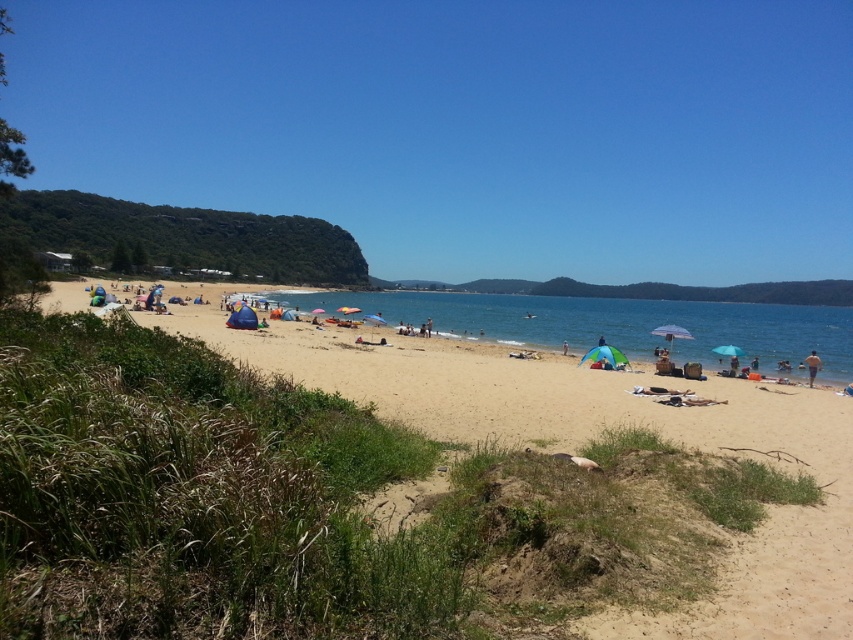
Question: Which of these objects is positioned closest to the clear blue water at center?

Choices:
 (A) tan skin person at lower right
 (B) transparent blue sky at upper center
 (C) beige sand beach at center

Answer: (C)

Question: Does beige sand beach at center come in front of clear blue water at center?

Choices:
 (A) no
 (B) yes

Answer: (B)

Question: Does beige sand beach at center have a lesser width compared to clear blue water at center?

Choices:
 (A) yes
 (B) no

Answer: (A)

Question: Which object appears closest to the camera in this image?

Choices:
 (A) blue fabric umbrella at center
 (B) transparent blue sky at upper center
 (C) clear blue water at center

Answer: (B)

Question: Which is nearer to the beige sand beach at center?

Choices:
 (A) blue fabric umbrella at center
 (B) tan skin person at lower right
 (C) transparent blue sky at upper center
 (D) clear blue water at center

Answer: (A)

Question: From the image, what is the correct spatial relationship of transparent blue sky at upper center in relation to beige sand beach at center?

Choices:
 (A) above
 (B) below

Answer: (A)